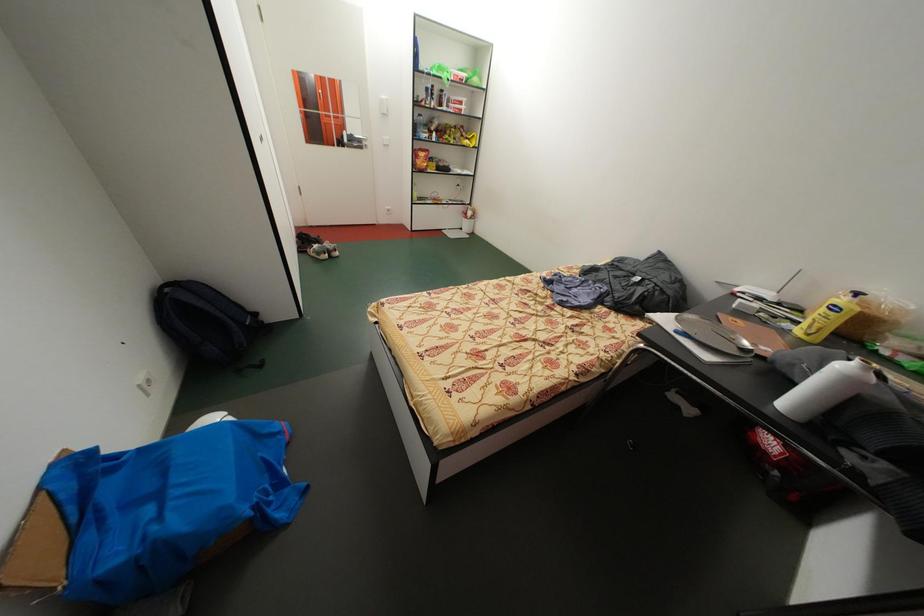
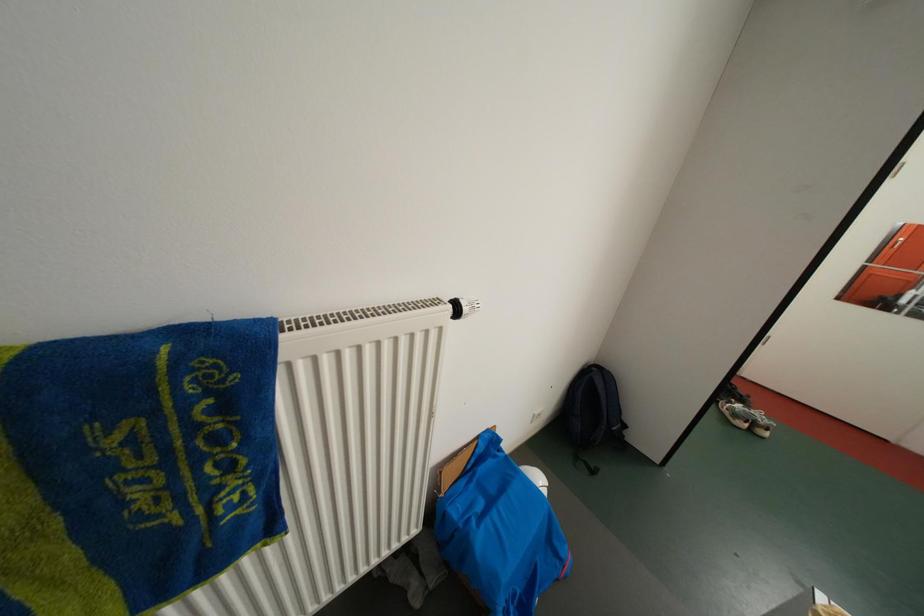
Question: The camera is either moving clockwise (left) or counter-clockwise (right) around the object. The first image is from the beginning of the video and the second image is from the end. Is the camera moving left or right when shooting the video?

Choices:
 (A) Left
 (B) Right

Answer: (B)